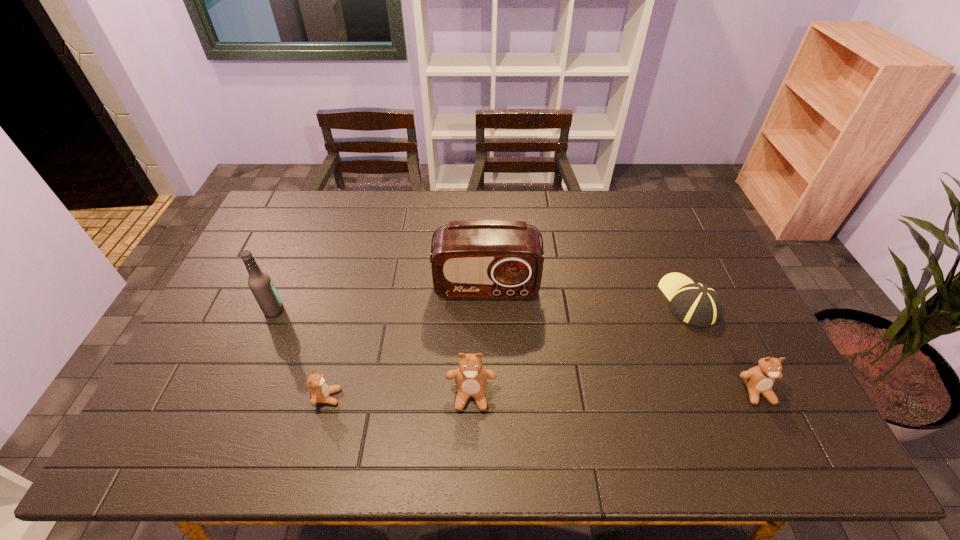
You are a GUI agent. You are given a task and a screenshot of the screen. Output one action in this format:
    pyautogui.click(x=<x>, y=<y>)
    Task: Click on the free space at the left edge of the desktop
    The image size is (960, 540).
    Given the screenshot: What is the action you would take?
    pyautogui.click(x=264, y=246)

Where is `vacant space at the right edge of the desktop`? vacant space at the right edge of the desktop is located at coordinates (x=718, y=374).

Where is `vacant space at the near left corner of the desktop`? The height and width of the screenshot is (540, 960). vacant space at the near left corner of the desktop is located at coordinates (183, 403).

Locate an element on the screen. The height and width of the screenshot is (540, 960). vacant space in between the second shortest teddy bear and the radio receiver is located at coordinates (621, 340).

This screenshot has width=960, height=540. In order to click on vacant area between the radio receiver and the beer bottle in this screenshot , I will do `click(380, 300)`.

The image size is (960, 540). In order to click on free space between the rightmost teddy bear and the leftmost object in this screenshot , I will do `click(516, 352)`.

Locate an element on the screen. Image resolution: width=960 pixels, height=540 pixels. empty space between the radio receiver and the rightmost teddy bear is located at coordinates (621, 340).

The height and width of the screenshot is (540, 960). I want to click on empty space between the rightmost teddy bear and the baseball cap, so click(722, 346).

Identify the location of vacant region between the rightmost teddy bear and the radio receiver. The height and width of the screenshot is (540, 960). tap(621, 340).

You are a GUI agent. You are given a task and a screenshot of the screen. Output one action in this format:
    pyautogui.click(x=<x>, y=<y>)
    Task: Click on the free space between the baseball cap and the second object from left to right
    
    Given the screenshot: What is the action you would take?
    pyautogui.click(x=508, y=349)